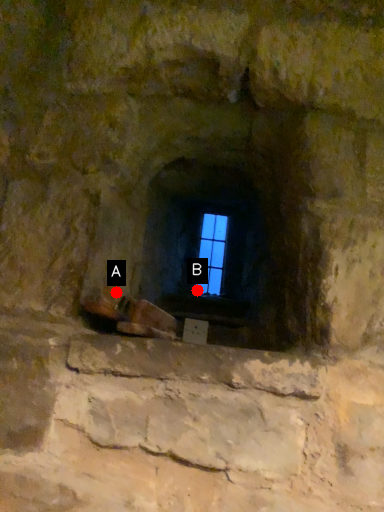
Question: Two points are circled on the image, labeled by A and B beside each circle. Among these points, which one is nearest to the camera?

Choices:
 (A) A is closer
 (B) B is closer

Answer: (A)